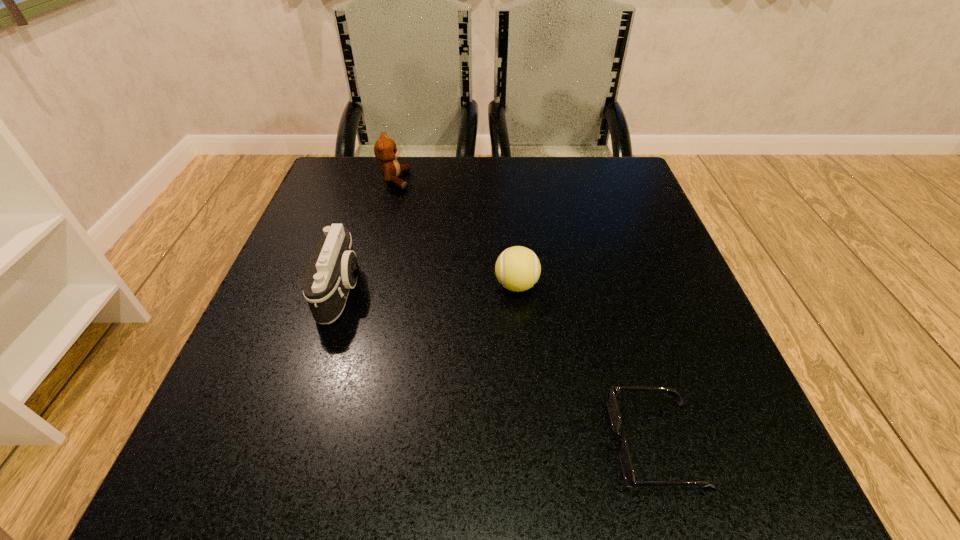
Find the location of a particular element. The width and height of the screenshot is (960, 540). free spot between the tennis ball and the shortest object is located at coordinates (587, 364).

At what (x,y) coordinates should I click in order to perform the action: click on free space between the camera and the sunglasses. Please return your answer as a coordinate pair (x, y). The width and height of the screenshot is (960, 540). Looking at the image, I should click on (499, 367).

At what (x,y) coordinates should I click in order to perform the action: click on unoccupied area between the nearest object and the camera. Please return your answer as a coordinate pair (x, y). This screenshot has height=540, width=960. Looking at the image, I should click on (499, 367).

Identify the location of vacant space that's between the farthest object and the third object from left to right. (456, 233).

At what (x,y) coordinates should I click in order to perform the action: click on unoccupied area between the farthest object and the shortest object. Please return your answer as a coordinate pair (x, y). The width and height of the screenshot is (960, 540). Looking at the image, I should click on (525, 312).

Identify which object is located as the second nearest to the nearest object. Please provide its 2D coordinates. Your answer should be formatted as a tuple, i.e. [(x, y)], where the tuple contains the x and y coordinates of a point satisfying the conditions above.

[(333, 270)]

In order to click on object identified as the second closest to the camera in this screenshot , I will do `click(517, 268)`.

Where is `free location that satisfies the following two spatial constraints: 1. on the front-facing side of the second object from right to left; 2. on the right side of the teddy bear`? free location that satisfies the following two spatial constraints: 1. on the front-facing side of the second object from right to left; 2. on the right side of the teddy bear is located at coordinates (367, 285).

Image resolution: width=960 pixels, height=540 pixels. Identify the location of vacant area that satisfies the following two spatial constraints: 1. on the front-facing side of the tennis ball; 2. on the right side of the teddy bear. (367, 285).